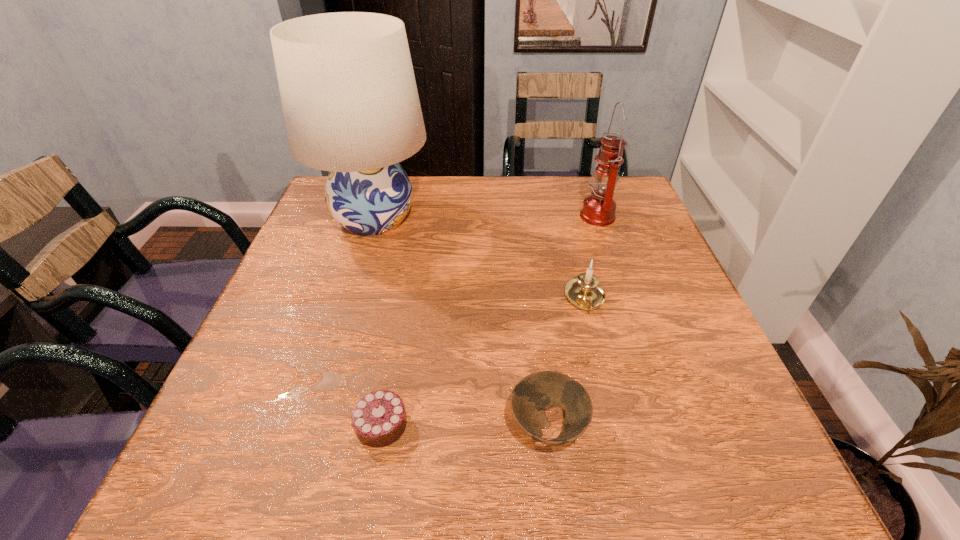
This screenshot has height=540, width=960. Identify the location of empty location between the third object from left to right and the second tallest object. (572, 321).

Locate an element on the screen. Image resolution: width=960 pixels, height=540 pixels. vacant region between the lampshade and the bowl is located at coordinates (461, 322).

Find the location of a particular element. Image resolution: width=960 pixels, height=540 pixels. vacant area that lies between the shortest object and the bowl is located at coordinates (465, 425).

This screenshot has width=960, height=540. What are the coordinates of `free space that is in between the candle holder and the fourth shortest object` in the screenshot? It's located at (591, 257).

Identify the location of unoccupied area between the shortest object and the second tallest object. (490, 320).

This screenshot has height=540, width=960. In order to click on unoccupied position between the candle holder and the chocolate cake in this screenshot , I will do (483, 361).

The height and width of the screenshot is (540, 960). Find the location of `the fourth closest object to the oil lamp`. the fourth closest object to the oil lamp is located at coordinates (379, 419).

Choose which object is the nearest neighbor to the lampshade. Please provide its 2D coordinates. Your answer should be formatted as a tuple, i.e. [(x, y)], where the tuple contains the x and y coordinates of a point satisfying the conditions above.

[(584, 291)]

Where is `blank space that satisfies the following two spatial constraints: 1. on the back side of the chocolate cake; 2. on the front-facing side of the lampshade`? blank space that satisfies the following two spatial constraints: 1. on the back side of the chocolate cake; 2. on the front-facing side of the lampshade is located at coordinates (419, 218).

Where is `free space that satisfies the following two spatial constraints: 1. on the back side of the chocolate cake; 2. on the left side of the second tallest object`? The image size is (960, 540). free space that satisfies the following two spatial constraints: 1. on the back side of the chocolate cake; 2. on the left side of the second tallest object is located at coordinates (420, 216).